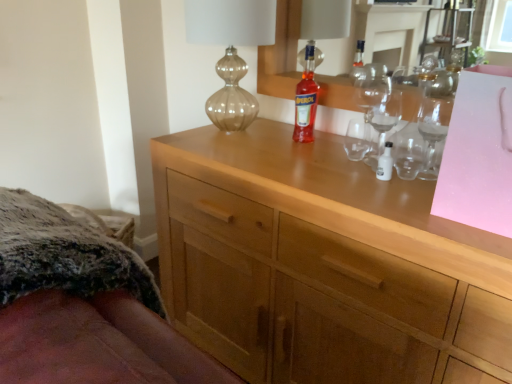
Question: Is transparent glass wine glass at upper right bigger than light wood cabinet at center?

Choices:
 (A) no
 (B) yes

Answer: (A)

Question: Can we say transparent glass wine glass at upper right lies outside light wood cabinet at center?

Choices:
 (A) no
 (B) yes

Answer: (B)

Question: From the image's perspective, does transparent glass wine glass at upper right appear higher than light wood cabinet at center?

Choices:
 (A) yes
 (B) no

Answer: (A)

Question: Considering the relative positions of transparent glass wine glass at upper right and light wood cabinet at center in the image provided, is transparent glass wine glass at upper right to the right of light wood cabinet at center from the viewer's perspective?

Choices:
 (A) no
 (B) yes

Answer: (B)

Question: Is light wood cabinet at center located within transparent glass wine glass at upper right?

Choices:
 (A) no
 (B) yes

Answer: (A)

Question: Is transparent glass wine glass at upper right beside light wood cabinet at center?

Choices:
 (A) yes
 (B) no

Answer: (B)

Question: From the image's perspective, is light wood cabinet at center below translucent glass vase at upper center?

Choices:
 (A) yes
 (B) no

Answer: (A)

Question: Is the depth of light wood cabinet at center less than that of translucent glass vase at upper center?

Choices:
 (A) no
 (B) yes

Answer: (B)

Question: Does light wood cabinet at center have a larger size compared to translucent glass vase at upper center?

Choices:
 (A) no
 (B) yes

Answer: (B)

Question: Could you tell me if light wood cabinet at center is facing translucent glass vase at upper center?

Choices:
 (A) yes
 (B) no

Answer: (B)

Question: Is light wood cabinet at center not near translucent glass vase at upper center?

Choices:
 (A) no
 (B) yes

Answer: (A)

Question: Does light wood cabinet at center lie behind translucent glass vase at upper center?

Choices:
 (A) no
 (B) yes

Answer: (A)

Question: Does fuzzy fabric bed at lower left have a greater width compared to translucent glass bottle at center?

Choices:
 (A) yes
 (B) no

Answer: (A)